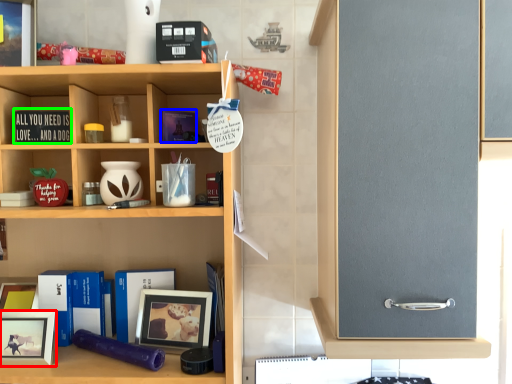
Question: Which is farther away from picture frame (highlighted by a red box)? book (highlighted by a blue box) or book (highlighted by a green box)?

Choices:
 (A) book
 (B) book

Answer: (A)